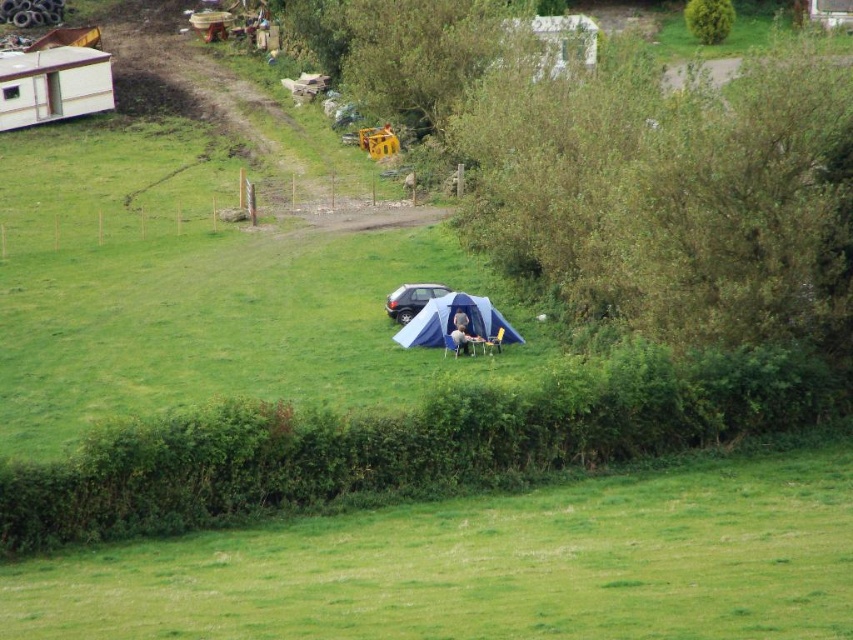
Question: Considering the real-world distances, which object is closest to the blue fabric tent at center?

Choices:
 (A) light brown fabric man at center
 (B) satin silver car at center

Answer: (A)

Question: Can you confirm if green leafy hedge at center right is positioned below green leafy hedge at lower center?

Choices:
 (A) yes
 (B) no

Answer: (B)

Question: Can you confirm if green leafy hedge at center right is wider than green leafy hedge at lower center?

Choices:
 (A) yes
 (B) no

Answer: (B)

Question: Which object appears farthest from the camera in this image?

Choices:
 (A) green leafy hedge at lower center
 (B) blue fabric tent at center
 (C) satin silver car at center
 (D) light brown fabric man at center

Answer: (C)

Question: Which of the following is the closest to the observer?

Choices:
 (A) (395, 292)
 (B) (461, 348)

Answer: (B)

Question: Observing the image, what is the correct spatial positioning of satin silver car at center in reference to light brown fabric man at center?

Choices:
 (A) right
 (B) left

Answer: (B)